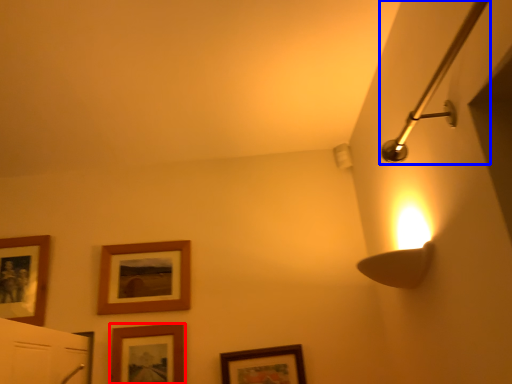
Question: Which object appears farthest to the camera in this image, picture frame (highlighted by a red box) or shower (highlighted by a blue box)?

Choices:
 (A) picture frame
 (B) shower

Answer: (A)